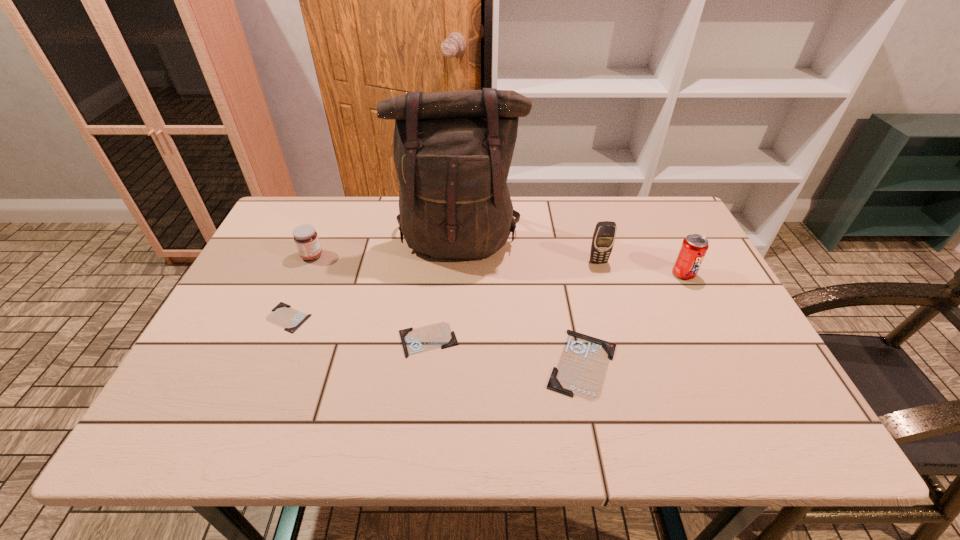
Please point a spot to add another identity card on the right. Please provide its 2D coordinates. Your answer should be formatted as a tuple, i.e. [(x, y)], where the tuple contains the x and y coordinates of a point satisfying the conditions above.

[(753, 390)]